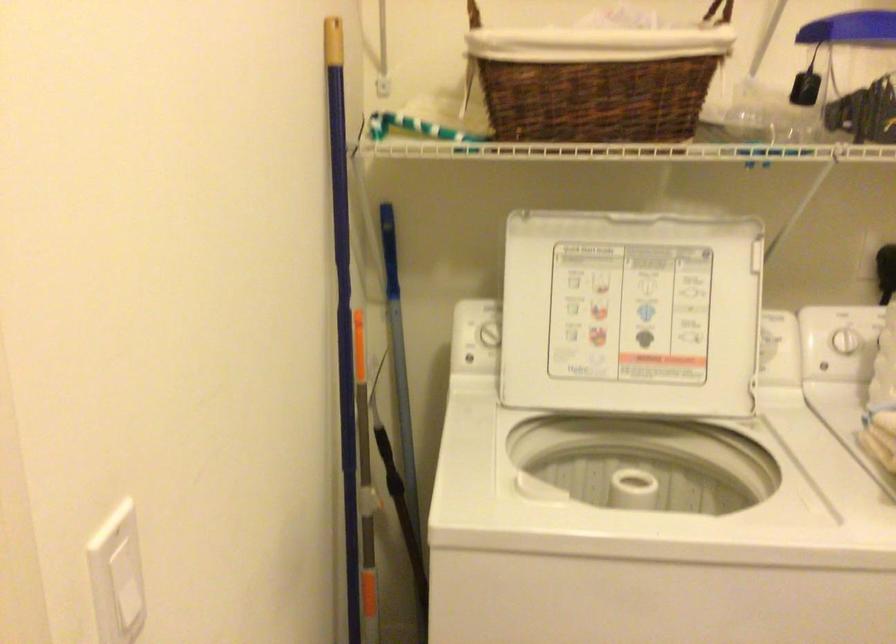
This screenshot has height=644, width=896. Describe the element at coordinates (597, 79) in the screenshot. I see `a wicker laundry basket` at that location.